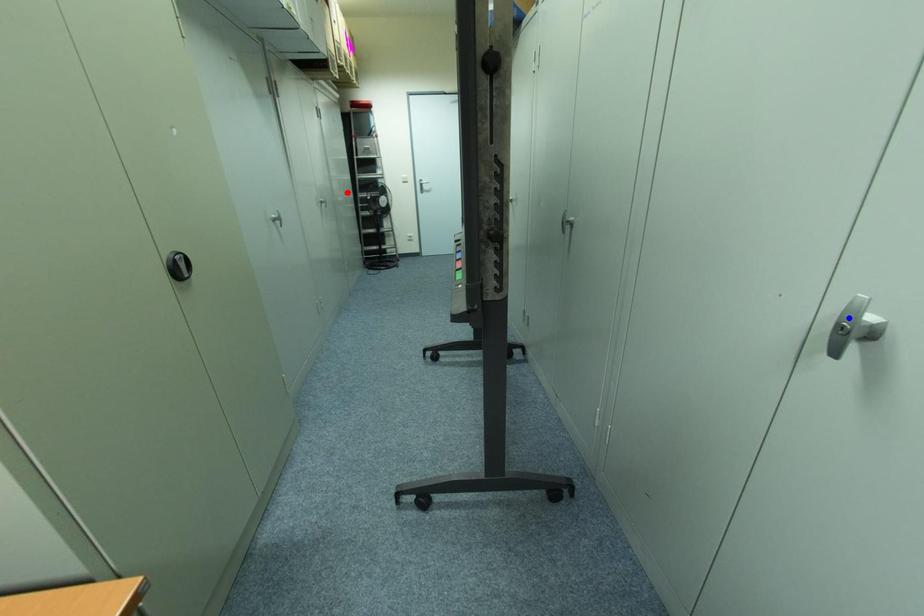
Question: Which of the two points in the image is closer to the camera?

Choices:
 (A) Blue point is closer.
 (B) Red point is closer.

Answer: (A)